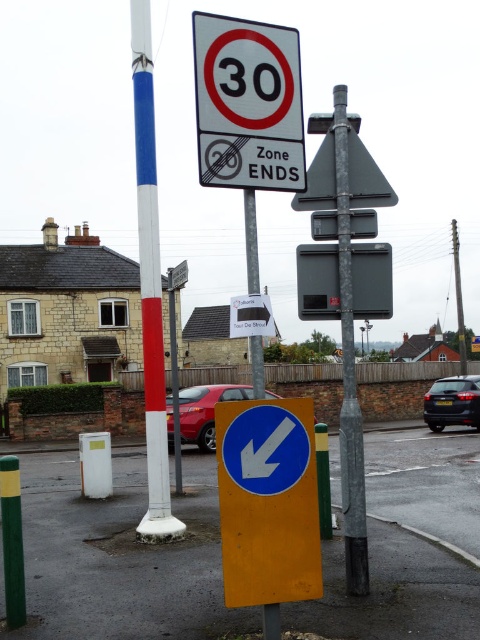
You are driving a car and see the metallic triangular sign at upper center and the metallic red car at center. Which object is nearer to you?

The metallic triangular sign at upper center is closer to the viewer than the metallic red car at center.

You are a driver approaching the intersection and need to know the position of the white plastic speed limit sign at upper center relative to the white painted pole at center. Which side of the pole is the sign located on?

The white plastic speed limit sign at upper center is positioned on the right side of the white painted pole at center.

You are a delivery driver approaching a road with two signs. You see the yellow matte arrow sign at lower center and the white plastic speed limit sign at upper center. Which of these two signs is narrower in width?

The yellow matte arrow sign at lower center is thinner than the white plastic speed limit sign at upper center, so it is narrower in width.